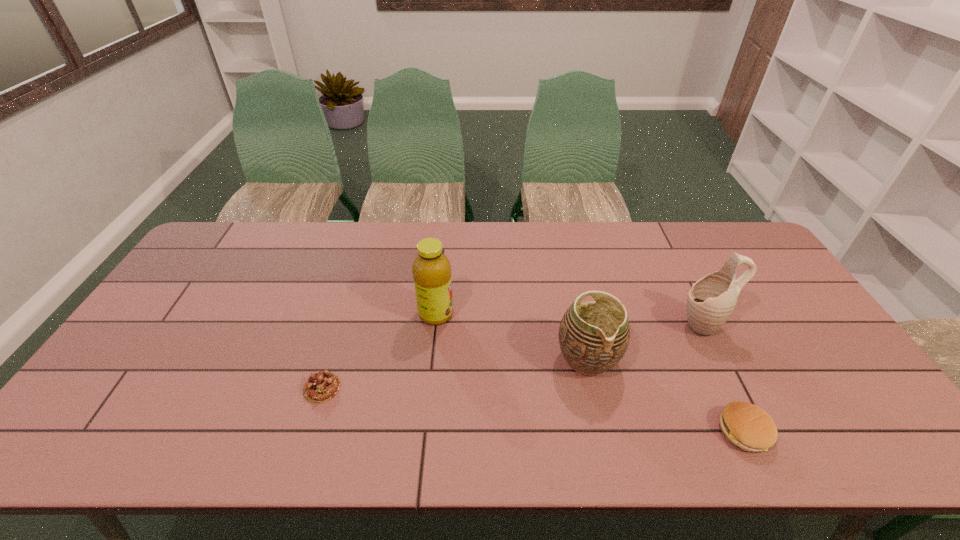
Where is `the fourth object from right to left`? the fourth object from right to left is located at coordinates (431, 270).

You are a GUI agent. You are given a task and a screenshot of the screen. Output one action in this format:
    pyautogui.click(x=<x>, y=<y>)
    Task: Click on the pitcher
    Image resolution: width=960 pixels, height=540 pixels.
    Given the screenshot: What is the action you would take?
    pyautogui.click(x=711, y=300)

Identify the location of pottery. (593, 336).

The image size is (960, 540). Identify the location of the third tallest object. (593, 336).

Where is `patty`? Image resolution: width=960 pixels, height=540 pixels. patty is located at coordinates (749, 427).

Identify the location of the nearest object. (749, 427).

The width and height of the screenshot is (960, 540). What are the coordinates of `the shortest object` in the screenshot? It's located at (322, 386).

Image resolution: width=960 pixels, height=540 pixels. In order to click on chocolate cake in this screenshot , I will do `click(322, 386)`.

Where is `free point located on the front label of the fruit juice`? This screenshot has width=960, height=540. free point located on the front label of the fruit juice is located at coordinates (501, 314).

Locate an element on the screen. The image size is (960, 540). free space located at the spout of the pitcher is located at coordinates (658, 325).